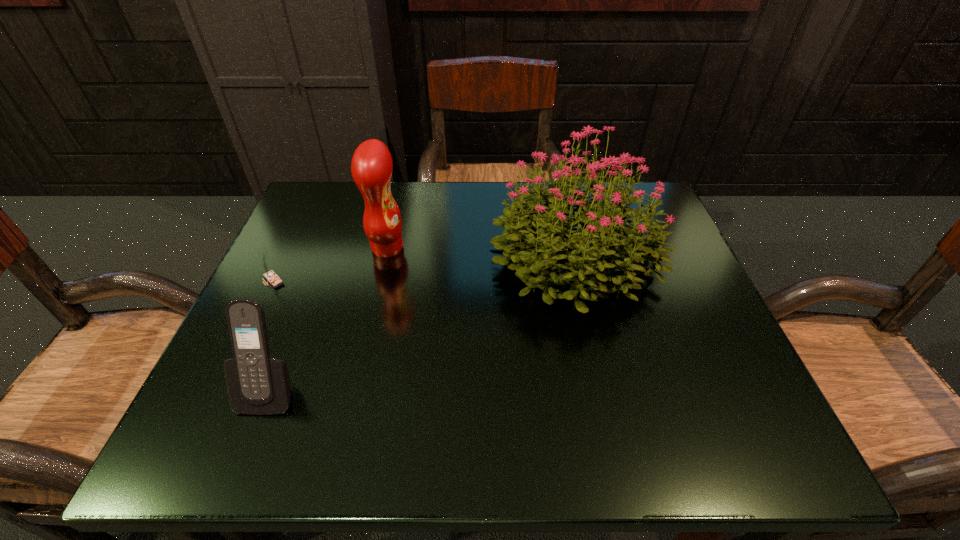
You are a GUI agent. You are given a task and a screenshot of the screen. Output one action in this format:
    pyautogui.click(x=<x>, y=<y>)
    Task: Click on the free space between the nearest object and the second object from right to left
    
    Given the screenshot: What is the action you would take?
    [329, 319]

Identify the location of vacant space that is in between the shortest object and the rightmost object. Image resolution: width=960 pixels, height=540 pixels. (x=424, y=267).

Where is `free area in between the third tallest object and the rightmost object`? This screenshot has height=540, width=960. free area in between the third tallest object and the rightmost object is located at coordinates (422, 321).

The width and height of the screenshot is (960, 540). In order to click on blank region between the tallest object and the second tallest object in this screenshot , I will do `click(481, 250)`.

Where is `free space between the bouquet and the cellular telephone`? The height and width of the screenshot is (540, 960). free space between the bouquet and the cellular telephone is located at coordinates click(422, 321).

Identify the location of free space between the second object from left to right and the tallest object. This screenshot has width=960, height=540. (422, 321).

In order to click on vacant space that is in between the shortest object and the bouquet in this screenshot , I will do `click(424, 267)`.

Locate which object is the closest to the matchbox. Please provide its 2D coordinates. Your answer should be formatted as a tuple, i.e. [(x, y)], where the tuple contains the x and y coordinates of a point satisfying the conditions above.

[(371, 167)]

Where is `object that can be found as the closest to the cellular telephone`? The image size is (960, 540). object that can be found as the closest to the cellular telephone is located at coordinates (269, 275).

Where is `blank area in the image that satisfies the following two spatial constraints: 1. on the label side of the second object from right to left; 2. on the back side of the tallest object`? This screenshot has height=540, width=960. blank area in the image that satisfies the following two spatial constraints: 1. on the label side of the second object from right to left; 2. on the back side of the tallest object is located at coordinates (386, 253).